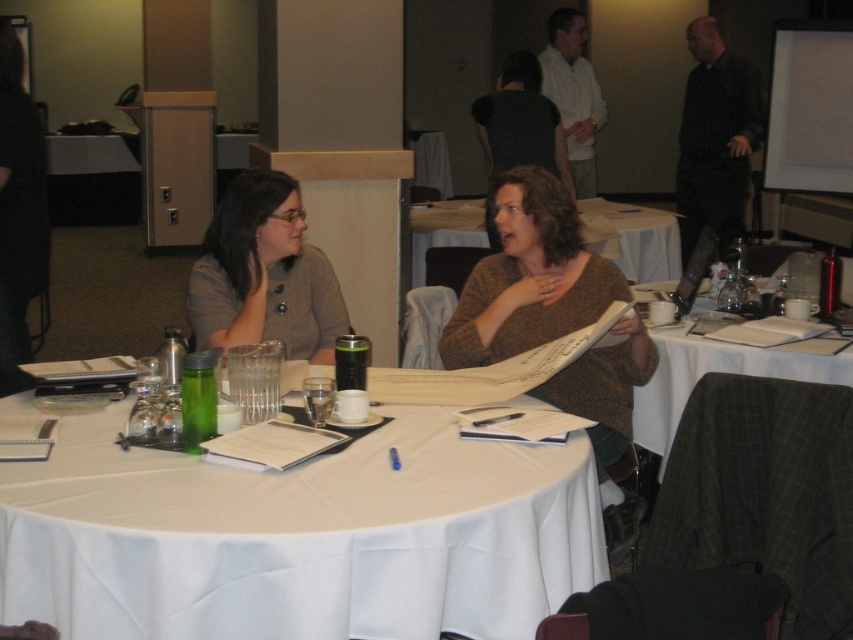
Is point (654, 401) behind point (633, 257)?

No, (654, 401) is closer to viewer.

Consider the image. Which of these two, white fabric table at lower right or white paper at center, stands taller?

white fabric table at lower right is taller.

Which is behind, point (776, 360) or point (643, 232)?

Positioned behind is point (643, 232).

Image resolution: width=853 pixels, height=640 pixels. Find the location of `white fabric table at lower right`. white fabric table at lower right is located at coordinates [715, 371].

Does matte gray sweater at center have a larger size compared to white paper at center?

No.

Who is more forward, (207, 340) or (625, 262)?

Positioned in front is point (207, 340).

In order to click on matte gray sweater at center in this screenshot , I will do `click(264, 275)`.

Can you confirm if brown fuzzy sweater at center is wider than white paper at center?

No, brown fuzzy sweater at center is not wider than white paper at center.

Who is more distant from viewer, (569, 381) or (477, 228)?

Point (477, 228)

Between point (618, 385) and point (589, 208), which one is positioned behind?

Positioned behind is point (589, 208).

In order to click on brown fuzzy sweater at center in this screenshot , I will do `click(527, 275)`.